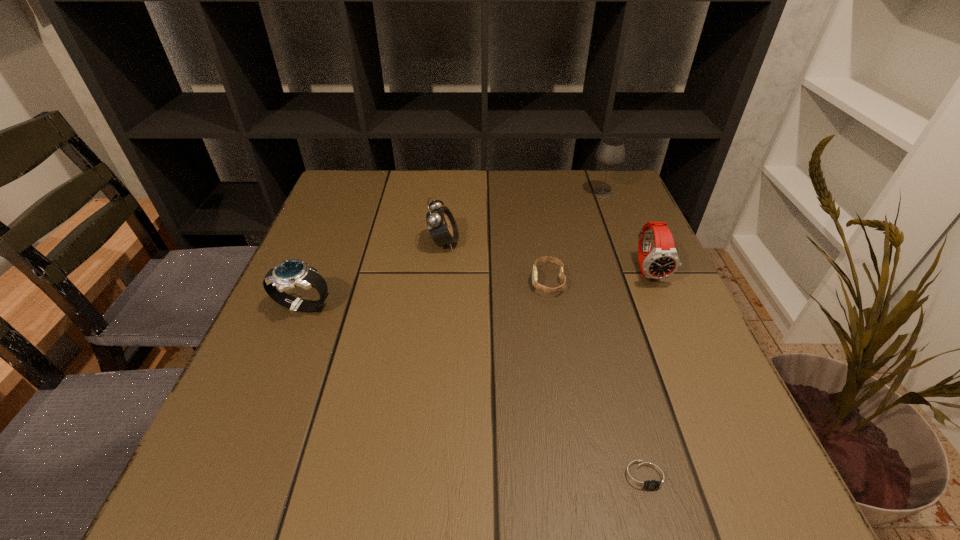
Identify the location of vacant point located 0.340m on the front of the wineglass. This screenshot has height=540, width=960. (639, 288).

Where is `vacant point located 0.180m on the face of the fifth object from right to left`? Image resolution: width=960 pixels, height=540 pixels. vacant point located 0.180m on the face of the fifth object from right to left is located at coordinates (536, 243).

Where is `free spot located on the face of the rightmost watch`? free spot located on the face of the rightmost watch is located at coordinates (701, 390).

I want to click on free spot located on the front of the second tallest watch, so click(x=220, y=507).

Locate an element on the screen. This screenshot has width=960, height=540. free region located 0.190m on the face of the fifth tallest object is located at coordinates (443, 281).

Locate an element on the screen. The image size is (960, 540). free point located 0.310m on the face of the fifth tallest object is located at coordinates (386, 281).

This screenshot has height=540, width=960. Find the location of `vacant space positioned 0.260m on the face of the fifth tallest object`. vacant space positioned 0.260m on the face of the fifth tallest object is located at coordinates point(410,281).

Identify the location of object present at the far edge. The image size is (960, 540). (611, 152).

At what (x,y) coordinates should I click in order to perform the action: click on object present at the near edge. Please return your answer as a coordinate pair (x, y). Image resolution: width=960 pixels, height=540 pixels. Looking at the image, I should click on (645, 476).

What are the coordinates of `object present at the left edge` in the screenshot? It's located at (291, 273).